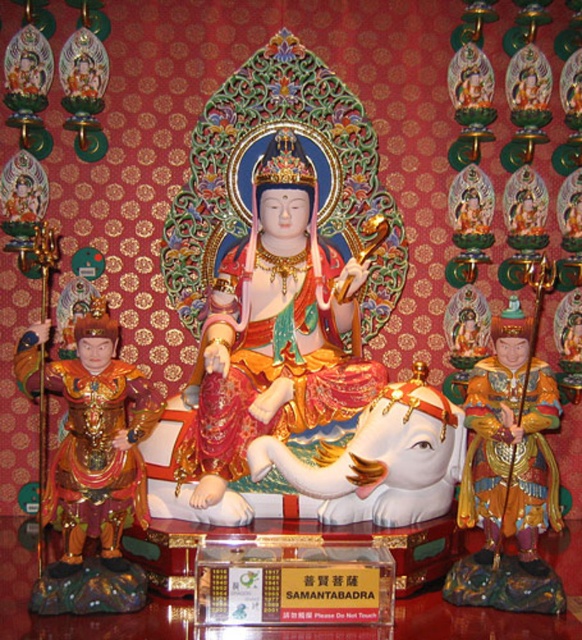
You are a temple guide who needs to ensure visitors maintain a safe distance of at least 6 meters from the glossy gold statue at center. A visitor is standing 6.25 meters away from it. Is the visitor within the required safety zone?

The visitor is standing 6.25 meters away from the glossy gold statue at center, which is beyond the required 6 meters safety zone. Therefore, the visitor is within the safe distance requirement.

From the picture: What is located at the coordinates point (274, 332) in the image?

The glossy gold statue at center is located at point (274, 332).